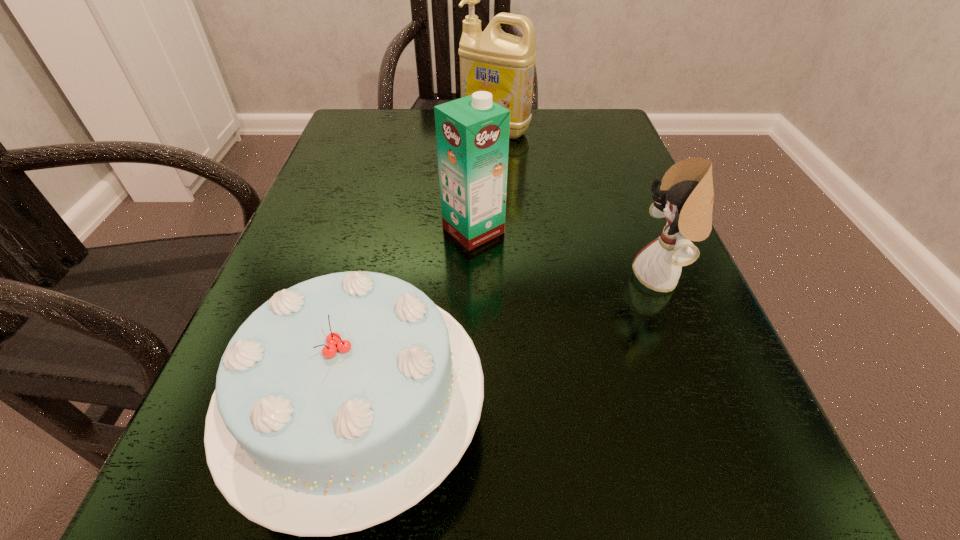
Image resolution: width=960 pixels, height=540 pixels. I want to click on vacant space at the far edge, so click(538, 138).

The image size is (960, 540). In the image, there is a desktop. Find the location of `vacant space at the near edge`. vacant space at the near edge is located at coordinates (476, 524).

The image size is (960, 540). I want to click on blank space at the left edge, so click(361, 227).

This screenshot has height=540, width=960. I want to click on blank space at the right edge of the desktop, so click(x=682, y=474).

In order to click on vacant space at the far left corner in this screenshot , I will do `click(348, 134)`.

I want to click on free space at the far right corner of the desktop, so click(x=622, y=143).

Image resolution: width=960 pixels, height=540 pixels. Find the location of `vacant area between the carton and the doll`. vacant area between the carton and the doll is located at coordinates (567, 254).

Locate an element on the screen. The height and width of the screenshot is (540, 960). empty space that is in between the detergent and the rightmost object is located at coordinates (578, 204).

Locate an element on the screen. vacant space that is in between the doll and the carton is located at coordinates (567, 254).

Locate an element on the screen. the second closest object relative to the carton is located at coordinates (686, 195).